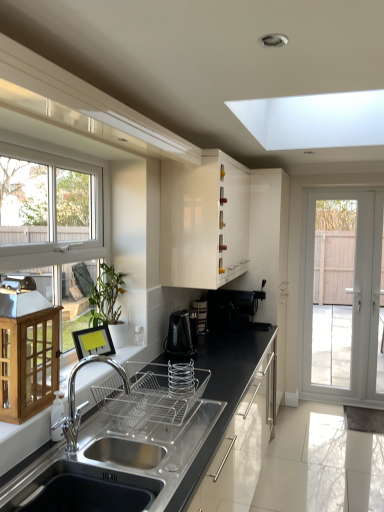
Question: Considering their positions, is white glossy cabinet at upper center, which is the 2th cabinetry in front-to-back order, located in front of or behind satin black kettle at center, which is the 2th appliance from back to front?

Choices:
 (A) behind
 (B) front

Answer: (B)

Question: Is white glossy cabinet at upper center, which is the 1th cabinetry in right-to-left order, wider or thinner than satin black kettle at center, the third appliance positioned from the front?

Choices:
 (A) wide
 (B) thin

Answer: (A)

Question: Estimate the real-world distances between objects in this image. Which object is farther from the satin black kettle at center, the third appliance positioned from the front?

Choices:
 (A) green matte plant at upper left
 (B) white glossy screen door at right
 (C) satin black countertop at lower center
 (D) white glossy door at right
 (E) black plastic coffee maker at upper right, positioned as the 4th appliance in front-to-back order

Answer: (D)

Question: Which object is positioned farthest from the satin black countertop at lower center?

Choices:
 (A) black glossy electric kettle at center, the 2th appliance when ordered from front to back
 (B) chrome metallic tap at sink left
 (C) green matte plant at upper left
 (D) white glossy screen door at right
 (E) white glossy door at right

Answer: (D)